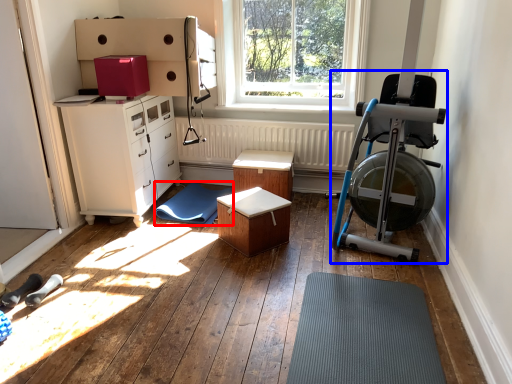
Question: Which object appears closest to the camera in this image, doormat (highlighted by a red box) or baby carriage (highlighted by a blue box)?

Choices:
 (A) doormat
 (B) baby carriage

Answer: (B)